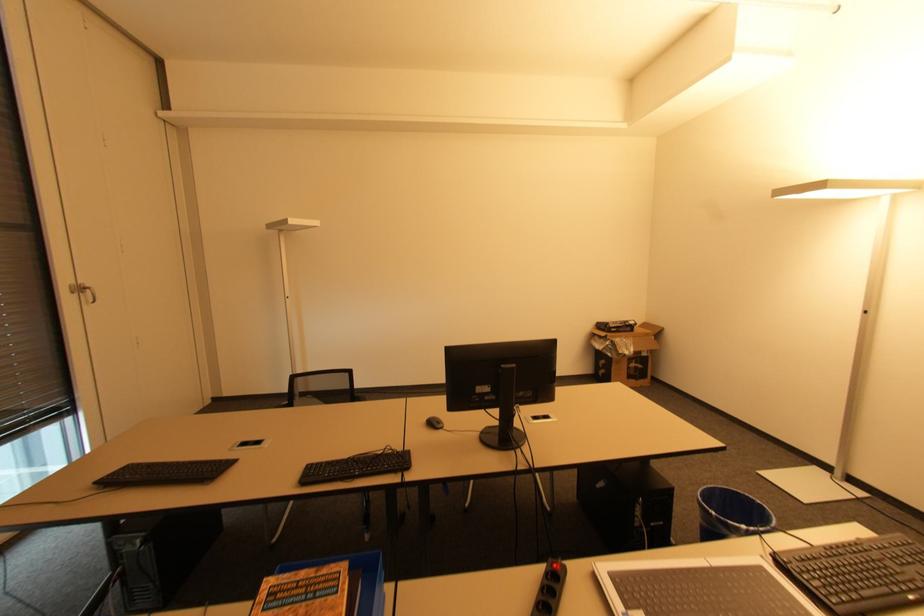
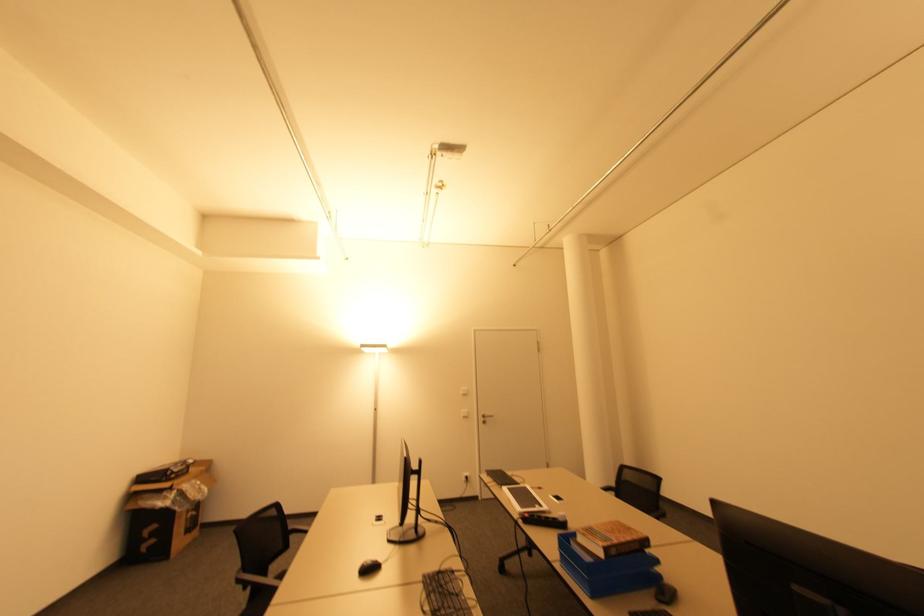
In the second image, find the point that corresponds to (x=410, y=452) in the first image.

(427, 576)